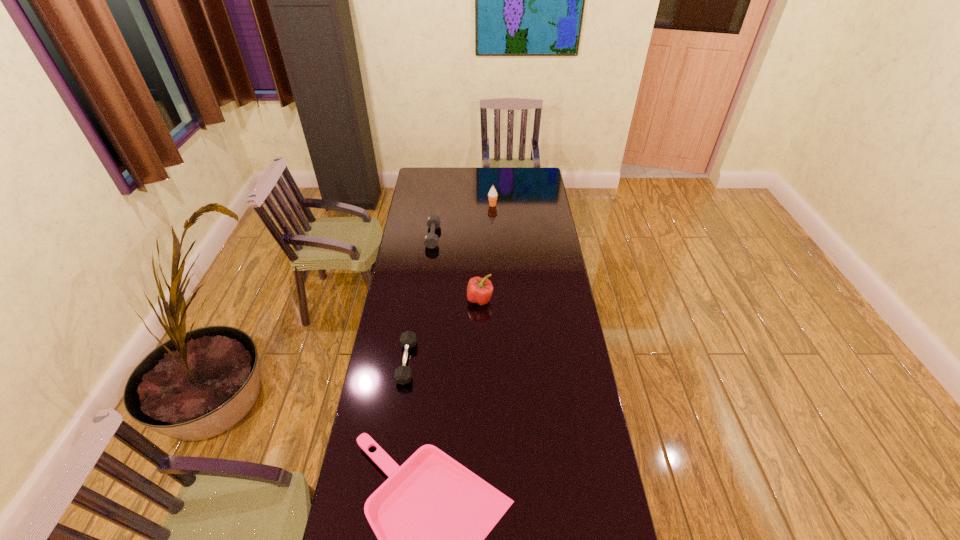
Identify the location of icecream. Image resolution: width=960 pixels, height=540 pixels. (492, 195).

I want to click on bell pepper, so click(x=479, y=290).

This screenshot has height=540, width=960. Identify the location of the fourth nearest object. (433, 221).

Image resolution: width=960 pixels, height=540 pixels. Find the location of `the fourth farthest object`. the fourth farthest object is located at coordinates (403, 374).

The width and height of the screenshot is (960, 540). Identify the location of vacant space situated on the right of the icecream. (538, 205).

Identify the location of vacant point located 0.300m on the back of the bell pepper. The image size is (960, 540). (480, 248).

At what (x,y) coordinates should I click in order to perform the action: click on free spot located on the right of the farther dumbbell. Please return your answer as a coordinate pair (x, y). This screenshot has height=540, width=960. Looking at the image, I should click on (453, 237).

What are the coordinates of `vacant space located on the front of the second nearest object` in the screenshot? It's located at (399, 414).

At what (x,y) coordinates should I click in order to perform the action: click on free space at the left edge of the desktop. Please return your answer as a coordinate pair (x, y). Looking at the image, I should click on (370, 406).

In the image, there is a desktop. Where is `vacant space at the right edge`? The width and height of the screenshot is (960, 540). vacant space at the right edge is located at coordinates (530, 201).